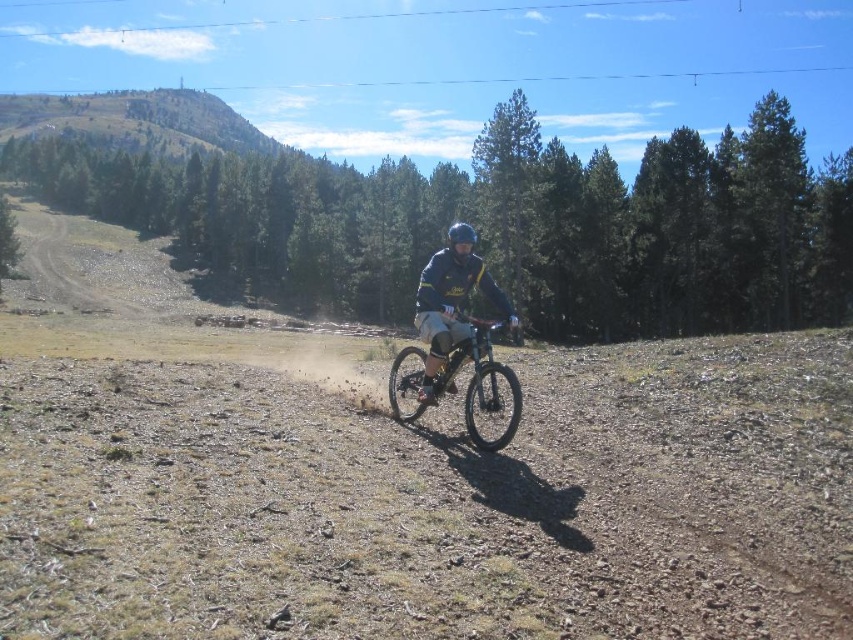
You are a photographer planning to capture a wide shot of the scene. You need to ensure both the shiny metallic bicycle at center and the dark blue jersey at center are fully visible in the frame. Given that the bicycle is wider than the jersey, which object requires more horizontal space in the photo composition?

The shiny metallic bicycle at center requires more horizontal space in the photo composition because its width is larger than the dark blue jersey at center.

You are navigating a mountain bike through the rugged terrain shown in the image. You need to decide whether to take a path that goes through point A, which is at coordinate point (473, 323), or point B, which is at coordinate point (468, 241). Based on their positions, which point is closer to your current position as you move forward?

Point A at coordinate point (473, 323) is in front of point B at coordinate point (468, 241), so if you are moving forward, point A is closer to your current position.